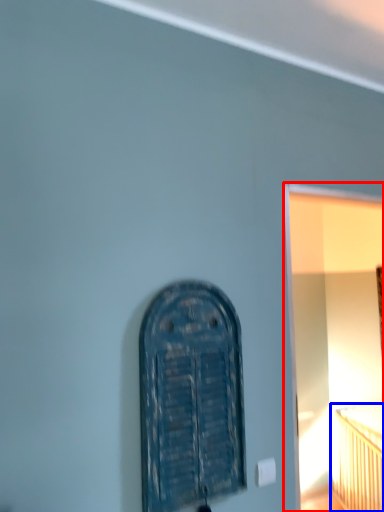
Question: Among these objects, which one is farthest to the camera, window frame (highlighted by a red box) or bed (highlighted by a blue box)?

Choices:
 (A) window frame
 (B) bed

Answer: (B)